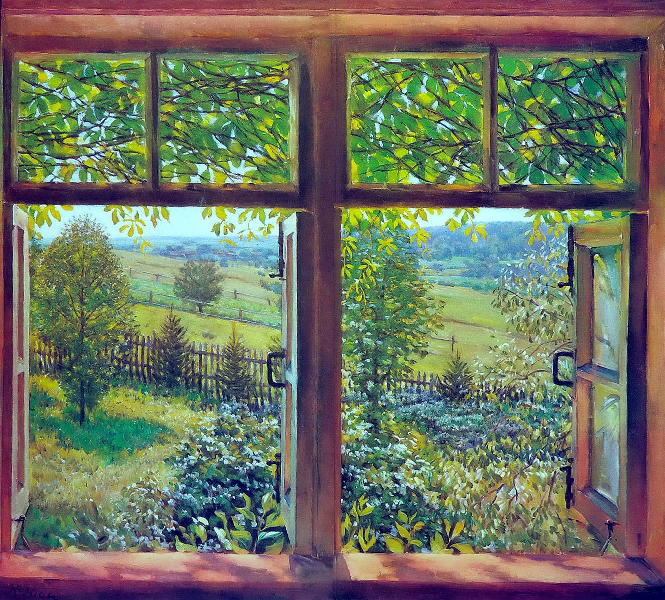
Where is `right side of window frame`? The image size is (665, 600). right side of window frame is located at coordinates (656, 511).